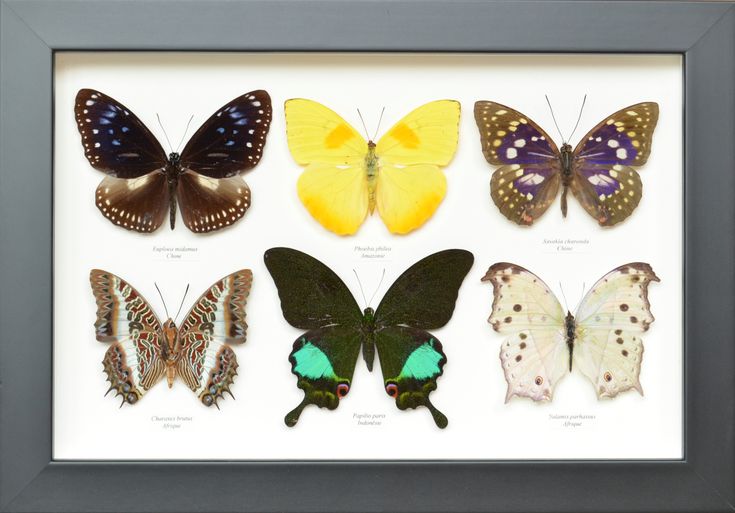
Find the location of a particular element. joint where frame sides connect is located at coordinates (21, 486), (706, 487), (698, 41), (35, 35).